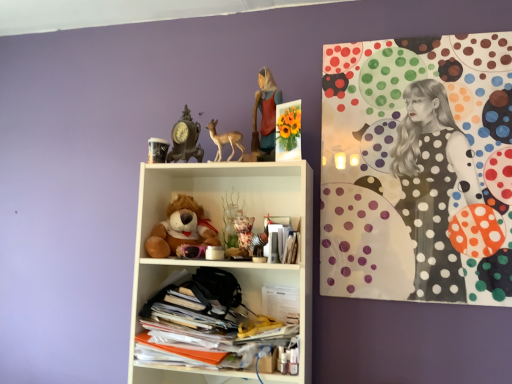
Question: Considering the relative positions of matte red dress at upper center and stacked papers at lower center, which ranks as the 1th shelf in bottom-to-top order, in the image provided, is matte red dress at upper center to the left or to the right of stacked papers at lower center, which ranks as the 1th shelf in bottom-to-top order,?

Choices:
 (A) left
 (B) right

Answer: (B)

Question: From the image's perspective, relative to stacked papers at lower center, marked as the second shelf in a top-to-bottom arrangement, is matte red dress at upper center above or below?

Choices:
 (A) above
 (B) below

Answer: (A)

Question: Estimate the real-world distances between objects in this image. Which object is farther from the matte brown deer at upper center?

Choices:
 (A) polka dot fabric at upper right
 (B) antique clock at upper center
 (C) white plastic shelf at center, positioned as the second shelf in bottom-to-top order
 (D) soft brown plush at center
 (E) white paper at center

Answer: (A)

Question: Which object is positioned farthest from the white plastic shelf at center, positioned as the second shelf in bottom-to-top order?

Choices:
 (A) matte red dress at upper center
 (B) antique clock at upper center
 (C) polka dot fabric at upper right
 (D) white paper at center
 (E) matte brown deer at upper center

Answer: (C)